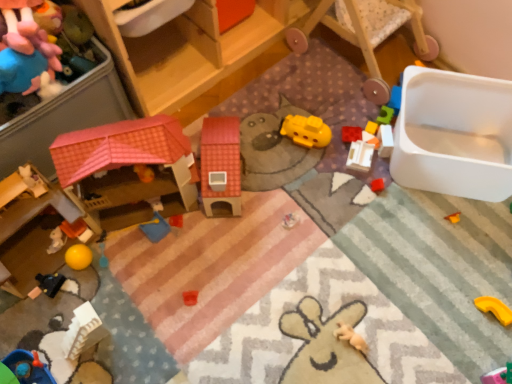
The image size is (512, 384). Find the location of `unoccupied space behind yellow matte submarine at center, which is the 5th toy in left-to-right order`. unoccupied space behind yellow matte submarine at center, which is the 5th toy in left-to-right order is located at coordinates (301, 95).